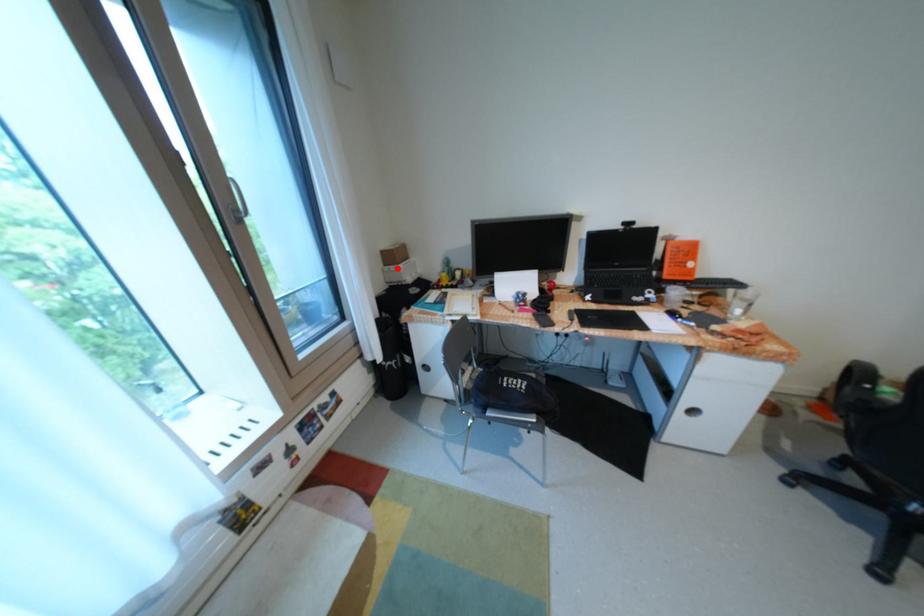
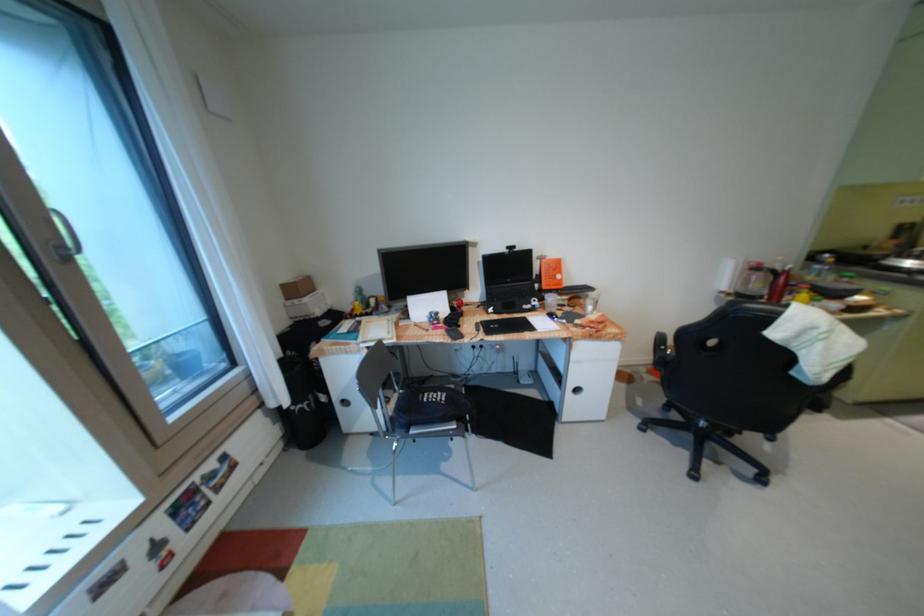
Locate, in the second image, the point that corresponds to the highlighted location in the first image.

(300, 302)